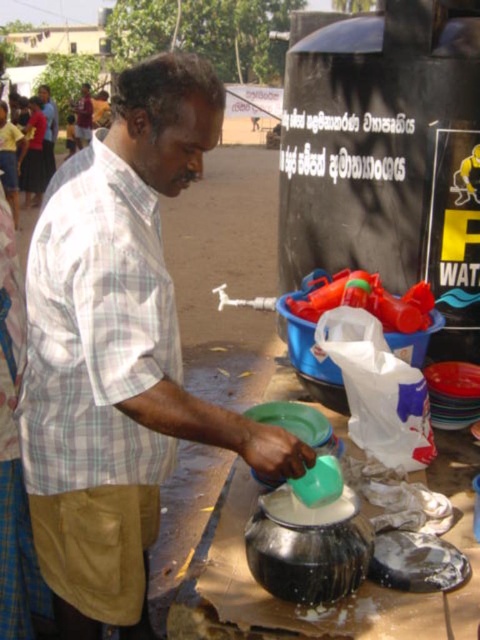
Is plaid cotton shirt at center wider than matte white shirt at center?

Incorrect, plaid cotton shirt at center's width does not surpass matte white shirt at center's.

Which is above, plaid cotton shirt at center or matte white shirt at center?

matte white shirt at center is higher up.

What do you see at coordinates (119, 353) in the screenshot? The width and height of the screenshot is (480, 640). I see `plaid cotton shirt at center` at bounding box center [119, 353].

I want to click on plaid cotton shirt at center, so click(x=119, y=353).